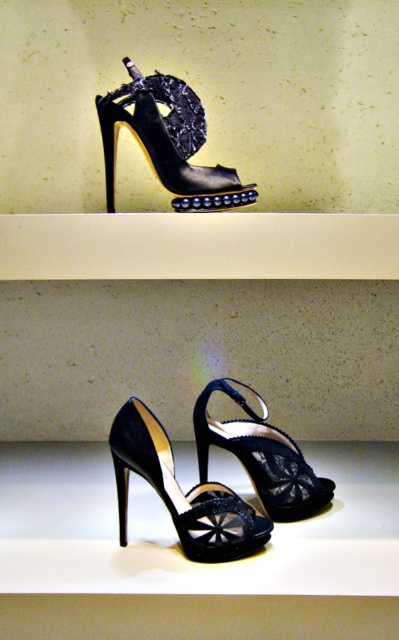
Question: Does black leather sandal at upper center have a larger size compared to shiny black sandal at center?

Choices:
 (A) no
 (B) yes

Answer: (B)

Question: Which object appears closest to the camera in this image?

Choices:
 (A) matte black sandal at center
 (B) black leather sandal at upper center

Answer: (A)

Question: Is black leather sandal at upper center positioned at the back of shiny black sandal at center?

Choices:
 (A) yes
 (B) no

Answer: (A)

Question: Is black leather sandal at upper center wider than matte black sandal at center?

Choices:
 (A) yes
 (B) no

Answer: (A)

Question: Among these points, which one is nearest to the camera?

Choices:
 (A) (256, 448)
 (B) (227, 540)
 (C) (215, 184)

Answer: (B)

Question: Which of these objects is positioned farthest from the black leather sandal at upper center?

Choices:
 (A) shiny black sandal at center
 (B) matte black sandal at center

Answer: (A)